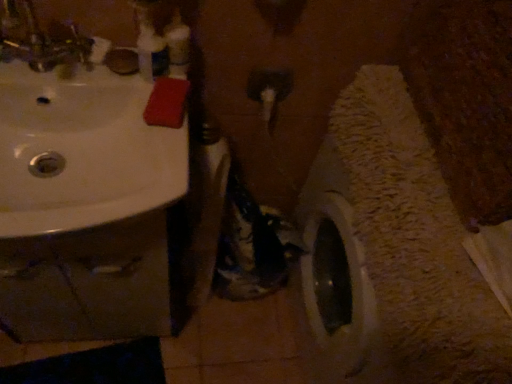
Question: Is brushed metal faucet at upper left in front of or behind white glossy sink at upper left in the image?

Choices:
 (A) front
 (B) behind

Answer: (A)

Question: Is brushed metal faucet at upper left situated inside white glossy sink at upper left or outside?

Choices:
 (A) outside
 (B) inside

Answer: (A)

Question: Which is nearer to the white glossy sink at upper left?

Choices:
 (A) translucent plastic bottle at upper center
 (B) brushed metal faucet at upper left

Answer: (B)

Question: Which is nearer to the white glossy sink at upper left?

Choices:
 (A) translucent plastic bottle at upper center
 (B) brushed metal faucet at upper left

Answer: (B)